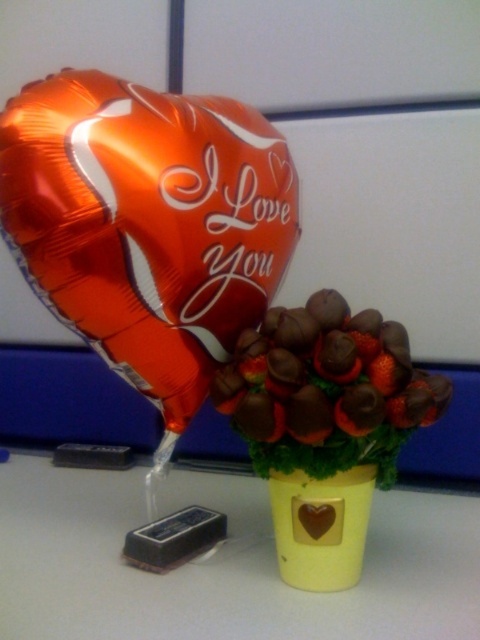
Question: Which point is farther from the camera taking this photo?

Choices:
 (A) (321, 371)
 (B) (187, 531)

Answer: (B)

Question: Which of the following is the closest to the observer?

Choices:
 (A) brushed metal chocolate bar at lower left
 (B) chocolate-covered strawberries at center
 (C) dark brown matte chocolate bar at lower left

Answer: (B)

Question: Is chocolate-covered strawberries at center behind brushed metal chocolate bar at lower left?

Choices:
 (A) no
 (B) yes

Answer: (A)

Question: Is dark brown matte chocolate bar at lower left smaller than brushed metal chocolate bar at lower left?

Choices:
 (A) yes
 (B) no

Answer: (B)

Question: Which point appears farthest from the camera in this image?

Choices:
 (A) (225, 528)
 (B) (115, 468)

Answer: (B)

Question: Is shiny metallic heart at upper left closer to camera compared to chocolate-covered strawberries at center?

Choices:
 (A) no
 (B) yes

Answer: (A)